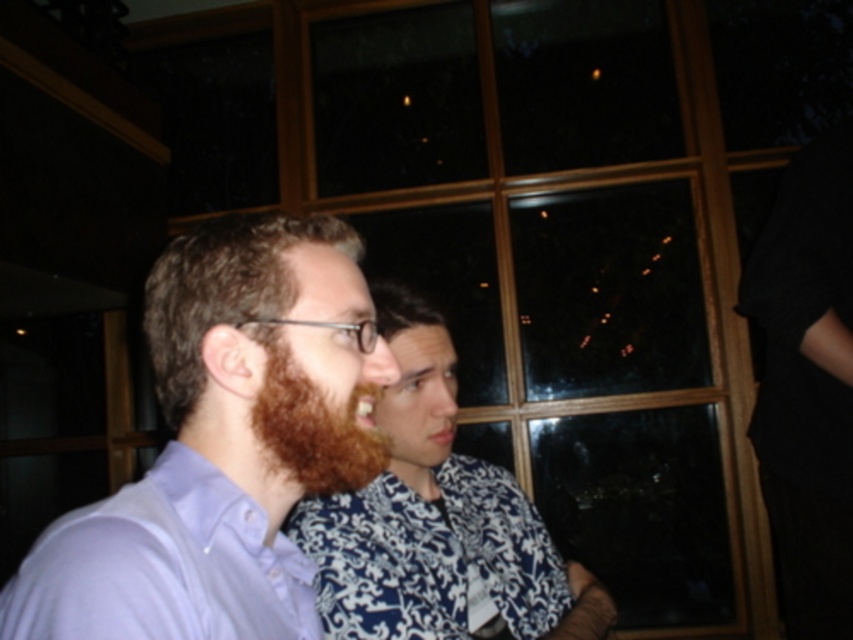
Does brown hair at center appear on the right side of brown fuzzy beard at center?

Indeed, brown hair at center is positioned on the right side of brown fuzzy beard at center.

Which is behind, point (434, 419) or point (265, 410)?

Point (434, 419)

Where is `brown hair at center`? brown hair at center is located at coordinates (437, 520).

Based on the photo, is light purple cotton shirt at left in front of brown fuzzy beard at center?

Yes, it is.

Can you confirm if light purple cotton shirt at left is bigger than brown fuzzy beard at center?

Indeed, light purple cotton shirt at left has a larger size compared to brown fuzzy beard at center.

Who is more distant from viewer, (x=207, y=481) or (x=260, y=417)?

The point (x=260, y=417) is behind.

Image resolution: width=853 pixels, height=640 pixels. I want to click on light purple cotton shirt at left, so click(x=163, y=564).

Who is positioned more to the right, matte purple shirt at center or brown fuzzy beard at center?

Positioned to the right is brown fuzzy beard at center.

Does point (189, 291) come closer to viewer compared to point (277, 433)?

No, (189, 291) is further to viewer.

This screenshot has height=640, width=853. In order to click on matte purple shirt at center in this screenshot , I will do `click(224, 444)`.